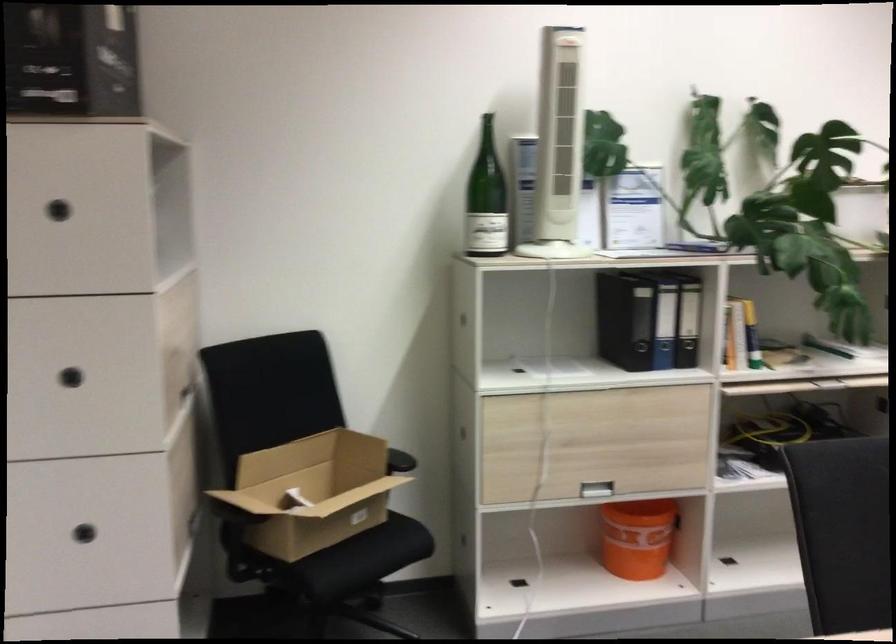
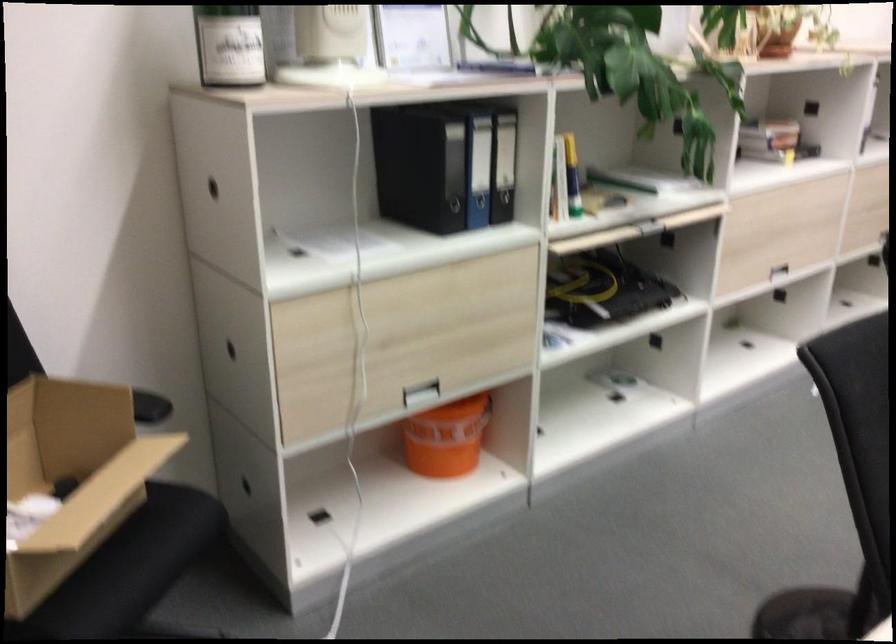
The point at (x=665, y=322) is marked in the first image. Where is the corresponding point in the second image?

(478, 169)